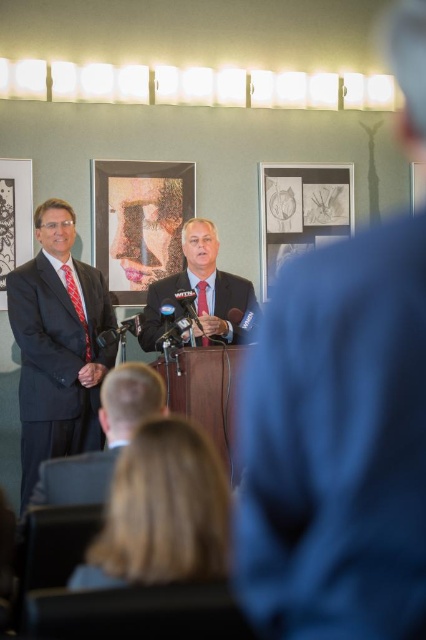
Does blonde hair at lower center come behind red silk tie at center?

No, blonde hair at lower center is closer to the viewer.

Locate an element on the screen. The width and height of the screenshot is (426, 640). blonde hair at lower center is located at coordinates (161, 512).

Which is above, blonde hair at lower center or matte black suit at center?

Positioned higher is matte black suit at center.

Between blonde hair at lower center and matte black suit at center, which one has less height?

blonde hair at lower center is shorter.

Is point (98, 548) positioned behind point (164, 292)?

No, (98, 548) is in front of (164, 292).

You are a GUI agent. You are given a task and a screenshot of the screen. Output one action in this format:
    pyautogui.click(x=<x>, y=<y>)
    Task: Click on the blonde hair at lower center
    The image size is (426, 640).
    Given the screenshot: What is the action you would take?
    pyautogui.click(x=161, y=512)

Is point (100, 531) positioned after point (348, 189)?

That is False.

Between blonde hair at lower center and black paper picture frame at center, which one has less height?

With less height is blonde hair at lower center.

The width and height of the screenshot is (426, 640). I want to click on blonde hair at lower center, so click(x=161, y=512).

The width and height of the screenshot is (426, 640). In order to click on blonde hair at lower center in this screenshot , I will do [161, 512].